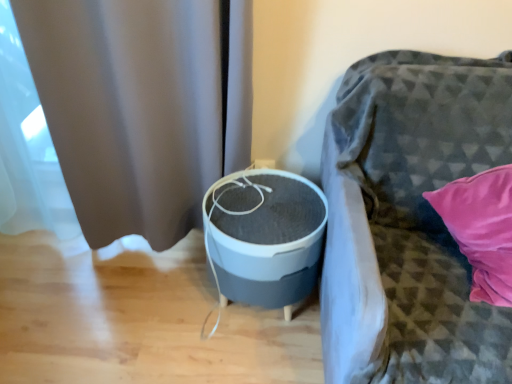
Question: Is textured gray fabric couch at right thinner than gray matte curtain at left?

Choices:
 (A) no
 (B) yes

Answer: (A)

Question: Does textured gray fabric couch at right have a smaller size compared to gray matte curtain at left?

Choices:
 (A) yes
 (B) no

Answer: (B)

Question: Can you confirm if textured gray fabric couch at right is bigger than gray matte curtain at left?

Choices:
 (A) no
 (B) yes

Answer: (B)

Question: From a real-world perspective, is textured gray fabric couch at right physically below gray matte curtain at left?

Choices:
 (A) no
 (B) yes

Answer: (B)

Question: From the image's perspective, is textured gray fabric couch at right located beneath gray matte curtain at left?

Choices:
 (A) yes
 (B) no

Answer: (A)

Question: Can you confirm if textured gray fabric couch at right is positioned to the left of gray matte curtain at left?

Choices:
 (A) no
 (B) yes

Answer: (A)

Question: Is gray matte/soft fabric round table at center oriented away from textured gray fabric couch at right?

Choices:
 (A) yes
 (B) no

Answer: (B)

Question: Could textured gray fabric couch at right be considered to be inside gray matte/soft fabric round table at center?

Choices:
 (A) no
 (B) yes

Answer: (A)

Question: Does gray matte/soft fabric round table at center have a smaller size compared to textured gray fabric couch at right?

Choices:
 (A) no
 (B) yes

Answer: (B)

Question: From the image's perspective, is gray matte/soft fabric round table at center above textured gray fabric couch at right?

Choices:
 (A) yes
 (B) no

Answer: (B)

Question: Does gray matte/soft fabric round table at center lie in front of textured gray fabric couch at right?

Choices:
 (A) yes
 (B) no

Answer: (B)

Question: Is gray matte/soft fabric round table at center in contact with textured gray fabric couch at right?

Choices:
 (A) yes
 (B) no

Answer: (B)

Question: Is gray matte curtain at left surrounded by gray matte/soft fabric round table at center?

Choices:
 (A) yes
 (B) no

Answer: (B)